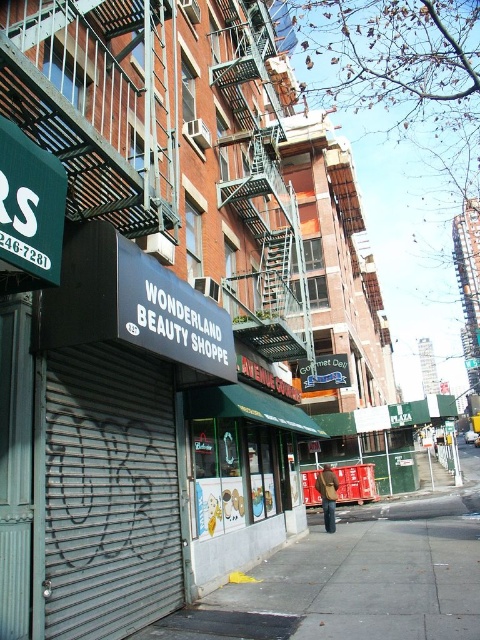
Question: Can you confirm if concrete sidewalk at lower center is thinner than metallic fire escape at upper center?

Choices:
 (A) no
 (B) yes

Answer: (A)

Question: Is concrete sidewalk at lower center wider than metallic fire escape at upper center?

Choices:
 (A) no
 (B) yes

Answer: (B)

Question: Which object appears farthest from the camera in this image?

Choices:
 (A) concrete sidewalk at lower center
 (B) metallic fire escape at upper center

Answer: (B)

Question: Can you confirm if concrete sidewalk at lower center is wider than metallic fire escape at upper center?

Choices:
 (A) no
 (B) yes

Answer: (B)

Question: Which of the following is the closest to the observer?

Choices:
 (A) concrete sidewalk at lower center
 (B) metallic fire escape at upper center

Answer: (A)